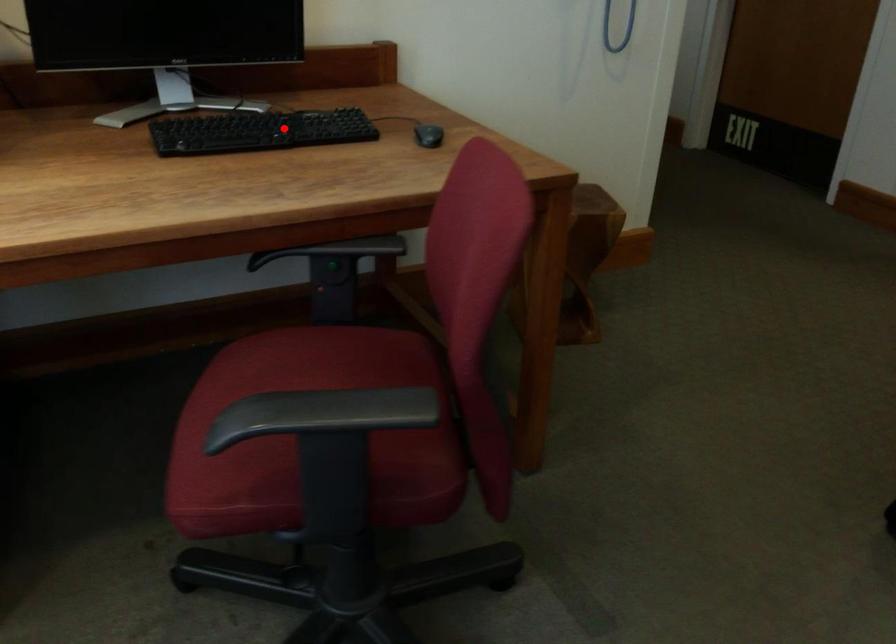
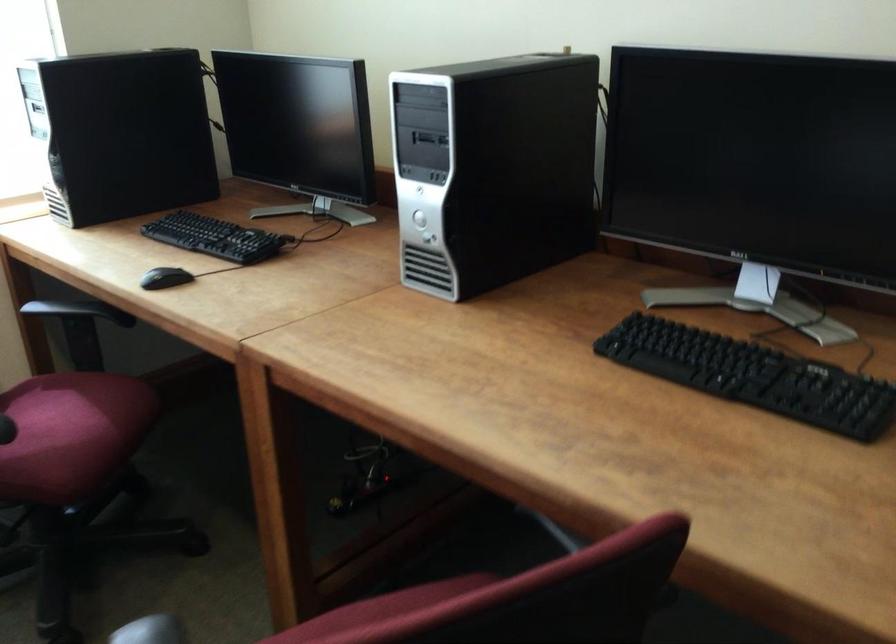
Find the pixel in the second image that matches the highlighted location in the first image.

(753, 375)